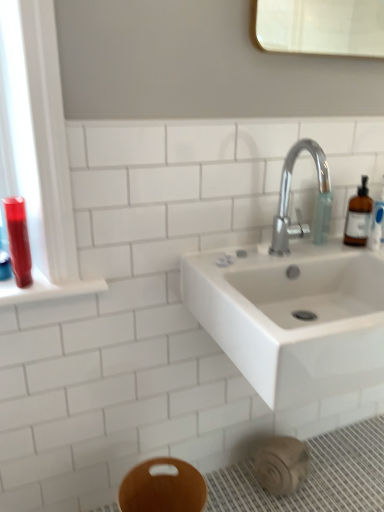
Question: Considering the positions of shiny red plastic mouthwash at left and polished chrome faucet at upper right in the image, is shiny red plastic mouthwash at left taller or shorter than polished chrome faucet at upper right?

Choices:
 (A) tall
 (B) short

Answer: (B)

Question: Considering the positions of shiny red plastic mouthwash at left and polished chrome faucet at upper right in the image, is shiny red plastic mouthwash at left wider or thinner than polished chrome faucet at upper right?

Choices:
 (A) thin
 (B) wide

Answer: (A)

Question: Estimate the real-world distances between objects in this image. Which object is closer to the translucent plastic soap dispenser at upper right?

Choices:
 (A) shiny red plastic mouthwash at left
 (B) wooden bidet at lower center
 (C) polished chrome faucet at upper right
 (D) translucent amber bottle at right

Answer: (C)

Question: Which of these objects is positioned farthest from the translucent amber bottle at right?

Choices:
 (A) polished chrome faucet at upper right
 (B) translucent plastic soap dispenser at upper right
 (C) wooden bidet at lower center
 (D) shiny red plastic mouthwash at left

Answer: (D)